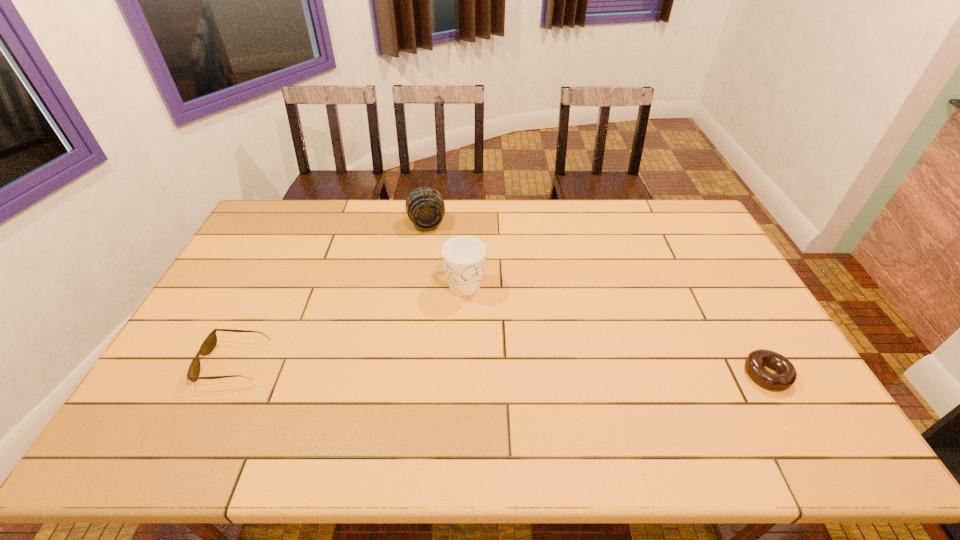
At what (x,y) coordinates should I click in order to perform the action: click on free space between the leftmost object and the doughnut. Please return your answer as a coordinate pair (x, y). Looking at the image, I should click on (500, 368).

Where is `vacant point located between the sunglasses and the second farthest object`? This screenshot has width=960, height=540. vacant point located between the sunglasses and the second farthest object is located at coordinates (349, 323).

Locate an element on the screen. This screenshot has height=540, width=960. free spot between the second object from right to left and the sunglasses is located at coordinates (349, 323).

Identify the location of free space between the rightmost object and the telephoto lens. The height and width of the screenshot is (540, 960). (596, 299).

Where is `free spot between the sunglasses and the third nearest object`? This screenshot has width=960, height=540. free spot between the sunglasses and the third nearest object is located at coordinates (349, 323).

Image resolution: width=960 pixels, height=540 pixels. Identify the location of vacant point located between the leftmost object and the mug. (349, 323).

Where is `object that is the second closest to the mug`? The image size is (960, 540). object that is the second closest to the mug is located at coordinates (208, 345).

Identify which object is the closest to the second farthest object. Please provide its 2D coordinates. Your answer should be formatted as a tuple, i.e. [(x, y)], where the tuple contains the x and y coordinates of a point satisfying the conditions above.

[(425, 207)]

Find the location of `vacant space that satisfies the following two spatial constraints: 1. on the front side of the farthest object; 2. on the right side of the mug`. vacant space that satisfies the following two spatial constraints: 1. on the front side of the farthest object; 2. on the right side of the mug is located at coordinates (418, 283).

Where is `vacant space that satisfies the following two spatial constraints: 1. on the front side of the second object from right to left; 2. on the right side of the rightmost object`? vacant space that satisfies the following two spatial constraints: 1. on the front side of the second object from right to left; 2. on the right side of the rightmost object is located at coordinates (462, 374).